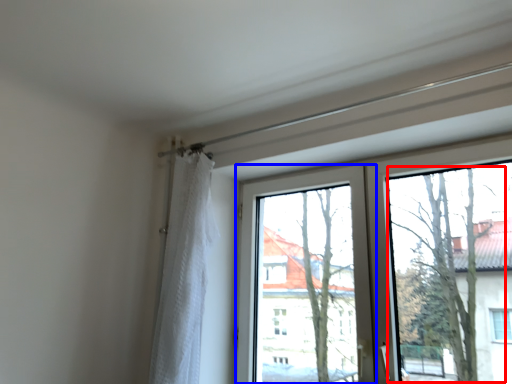
Question: Which object appears farthest to the camera in this image, tree (highlighted by a red box) or window screen (highlighted by a blue box)?

Choices:
 (A) tree
 (B) window screen

Answer: (B)